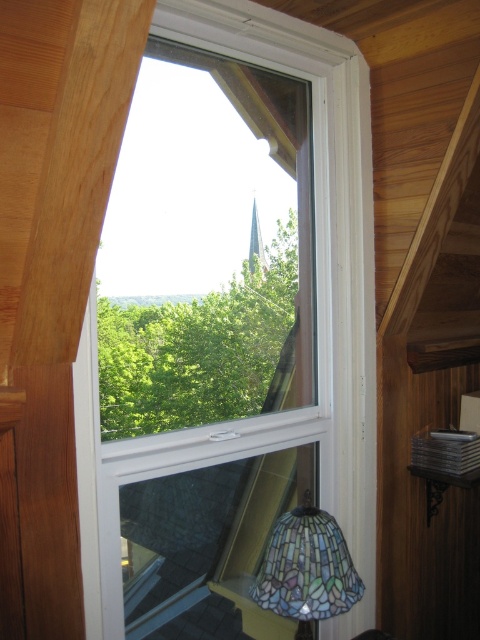
You are an interior designer assessing the room through the window. You need to determine which object occupies more space in the image. Which one is larger between the clear glass window at center and the stained glass lampshade at lower right?

The clear glass window at center has a larger size compared to the stained glass lampshade at lower right, so the clear glass window at center occupies more space in the image.

You are standing in the room and want to look outside through the clear glass window at center. Where should you position yourself to see the reflection of the stained glass lampshade in the window?

You should position yourself near the bottom right corner of the clear glass window at center to see the reflection of the stained glass lampshade, as the lampshade is positioned near the bottom right corner of the window.